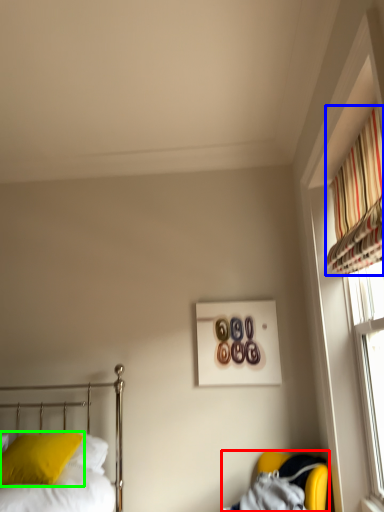
Question: Which object is the closest to the armchair (highlighted by a red box)? Choose among these: curtain (highlighted by a blue box) or pillow (highlighted by a green box).

Choices:
 (A) curtain
 (B) pillow

Answer: (B)